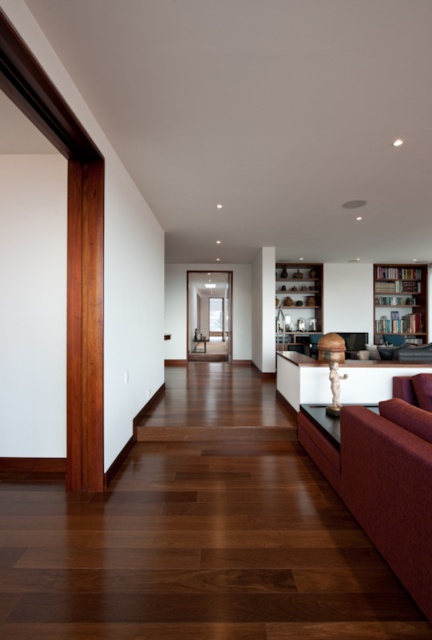
Consider the image. Who is lower down, burgundy fabric couch at lower right or wooden bookshelf at right?

burgundy fabric couch at lower right

Is point (387, 440) closer to camera compared to point (383, 268)?

Yes, point (387, 440) is in front of point (383, 268).

Locate an element on the screen. burgundy fabric couch at lower right is located at coordinates pos(393,484).

Which is below, burgundy fabric couch at lower right or wooden shelves at center?

burgundy fabric couch at lower right

Describe the element at coordinates (393, 484) in the screenshot. I see `burgundy fabric couch at lower right` at that location.

Locate an element on the screen. Image resolution: width=432 pixels, height=640 pixels. burgundy fabric couch at lower right is located at coordinates (393, 484).

Locate an element on the screen. The height and width of the screenshot is (640, 432). burgundy fabric couch at lower right is located at coordinates (393, 484).

Between wooden shelves at center and wooden bookshelf at right, which one appears on the right side from the viewer's perspective?

wooden bookshelf at right is more to the right.

Find the location of a particular element. wooden shelves at center is located at coordinates (298, 305).